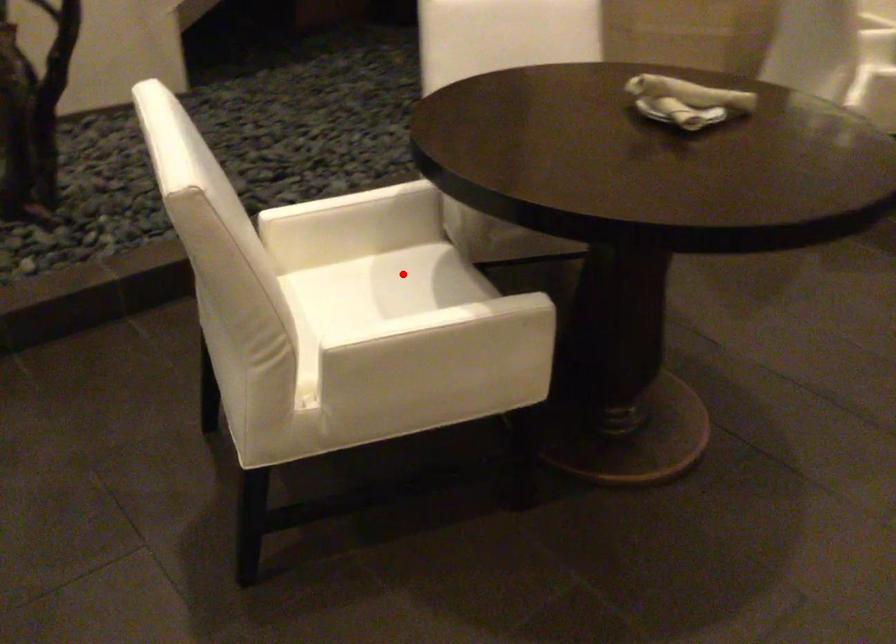
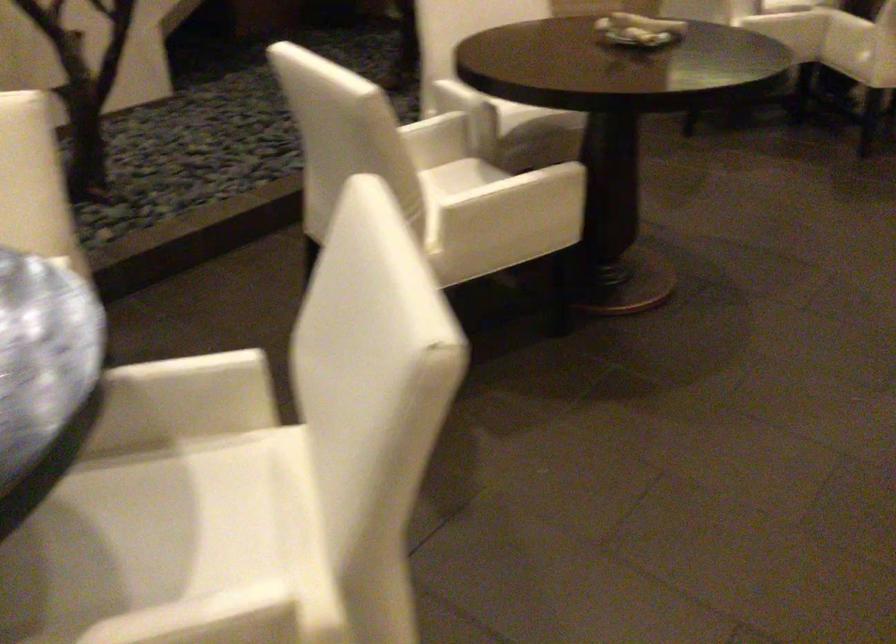
Where in the second image is the point corresponding to the highlighted location from the first image?

(455, 176)